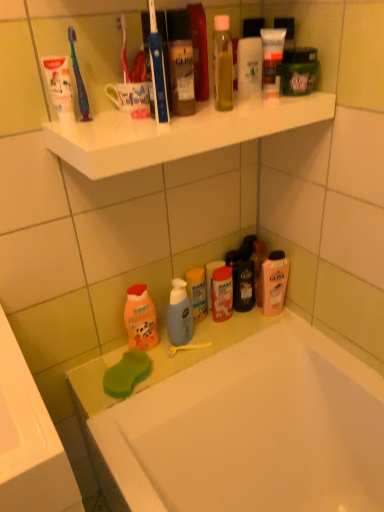
The image size is (384, 512). I want to click on vacant area situated to the left side of green matte jar at upper right, which is the second mouthwash from bottom to top, so click(241, 102).